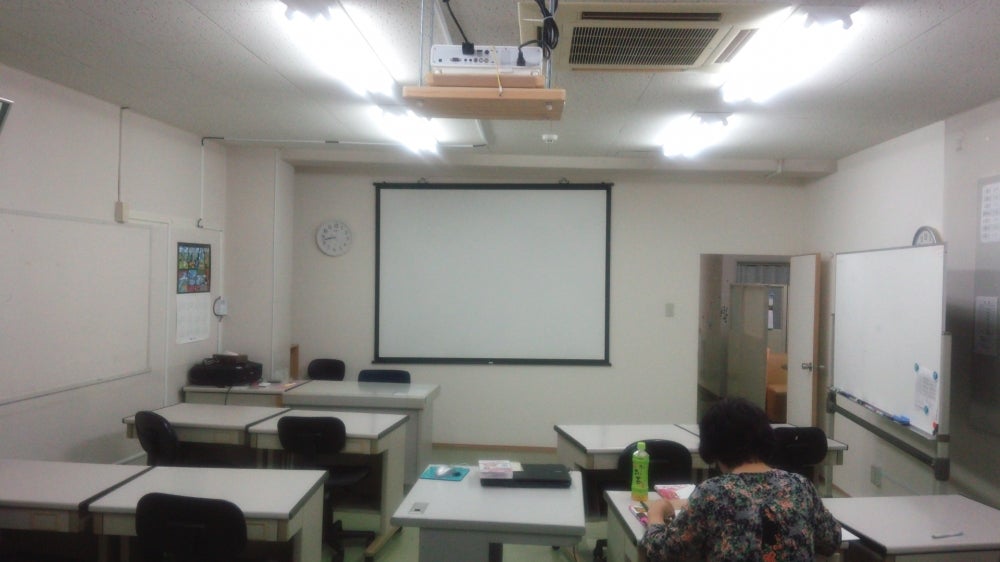
Locate an element on the screen. This screenshot has width=1000, height=562. clock is located at coordinates (325, 222), (329, 241), (935, 244), (916, 240), (343, 231).